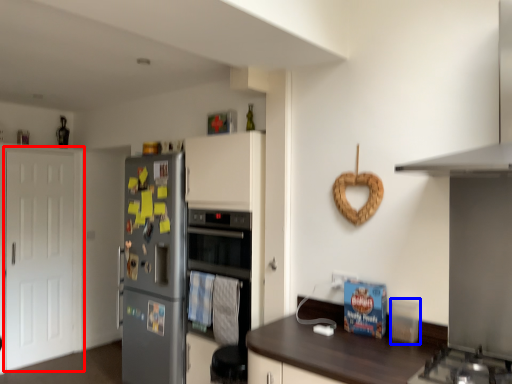
Question: Which object is further to the camera taking this photo, door (highlighted by a red box) or appliance (highlighted by a blue box)?

Choices:
 (A) door
 (B) appliance

Answer: (A)